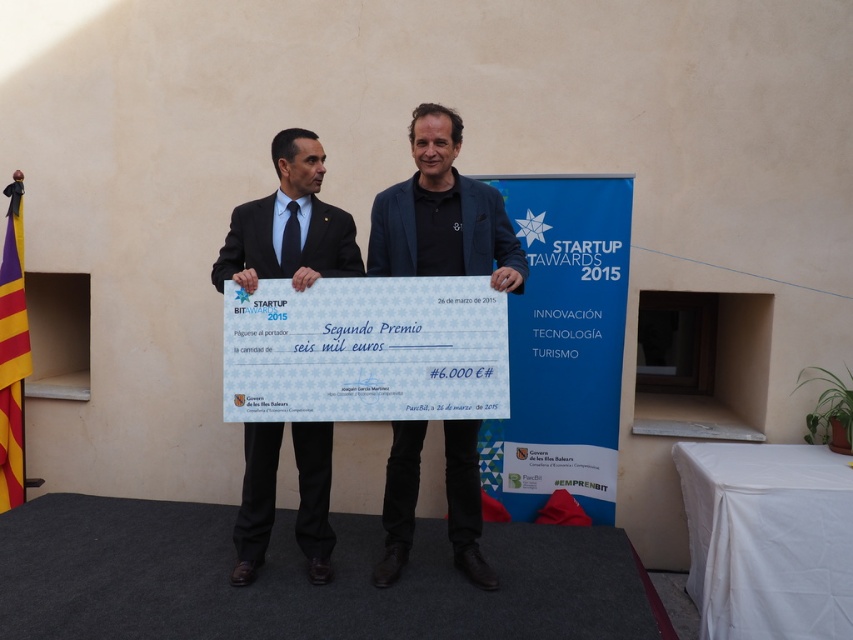
Question: Is dark blue woolen suit at center in front of matte black suit at center?

Choices:
 (A) yes
 (B) no

Answer: (A)

Question: Which of the following is the closest to the observer?

Choices:
 (A) (461, 496)
 (B) (247, 234)

Answer: (B)

Question: Does dark blue woolen suit at center appear over matte black suit at center?

Choices:
 (A) yes
 (B) no

Answer: (A)

Question: Which point is farther to the camera?

Choices:
 (A) matte black suit at center
 (B) dark blue woolen suit at center

Answer: (A)

Question: Is dark blue woolen suit at center thinner than matte black suit at center?

Choices:
 (A) no
 (B) yes

Answer: (A)